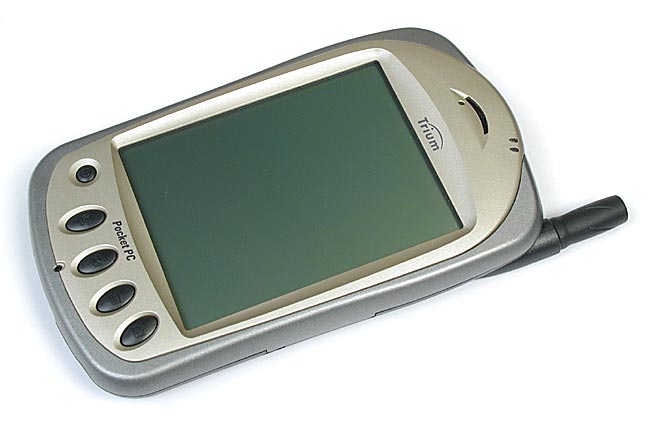
Find the location of a particular element. Image resolution: width=650 pixels, height=421 pixels. speaker is located at coordinates (55, 269).